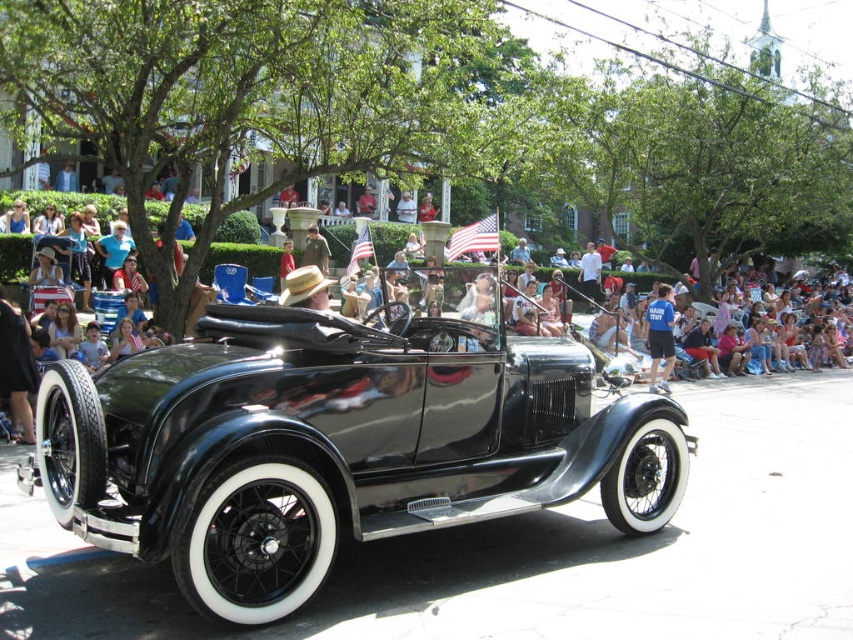
Question: Which of the following is the farthest from the observer?

Choices:
 (A) (384, 230)
 (B) (653, 384)

Answer: (A)

Question: Can you confirm if matte black car at center is positioned above blue cotton shirt at center?

Choices:
 (A) no
 (B) yes

Answer: (B)

Question: Is matte black car at center thinner than blue cotton shirt at center?

Choices:
 (A) no
 (B) yes

Answer: (A)

Question: Which point is farther from the camera taking this photo?

Choices:
 (A) (576, 408)
 (B) (96, 211)
 (C) (663, 369)

Answer: (B)

Question: Does matte black car at center have a smaller size compared to blue cotton shirt at center?

Choices:
 (A) no
 (B) yes

Answer: (A)

Question: Based on their relative distances, which object is nearer to the blue cotton shirt at center?

Choices:
 (A) shiny black car at center
 (B) matte black car at center

Answer: (A)